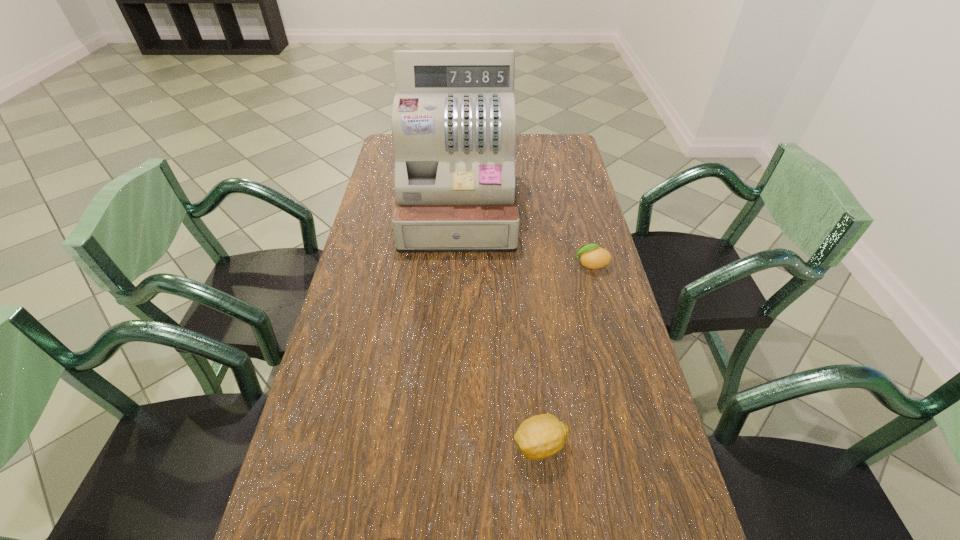
The image size is (960, 540). In order to click on vacant region between the left lemon and the tallest object in this screenshot , I will do `click(499, 327)`.

Locate an element on the screen. Image resolution: width=960 pixels, height=540 pixels. free area in between the rightmost object and the tallest object is located at coordinates (524, 237).

Where is `vacant point located between the farther lemon and the tallest object`? The image size is (960, 540). vacant point located between the farther lemon and the tallest object is located at coordinates (524, 237).

Locate an element on the screen. This screenshot has height=540, width=960. free space between the right lemon and the nearest object is located at coordinates (565, 355).

Locate an element on the screen. Image resolution: width=960 pixels, height=540 pixels. vacant region between the left lemon and the right lemon is located at coordinates point(565,355).

Identify the location of the second closest object to the rightmost object. (541, 436).

The height and width of the screenshot is (540, 960). I want to click on object that is the second closest to the nearer lemon, so click(x=453, y=122).

Select which lemon is the second closest to the tallest object. Please provide its 2D coordinates. Your answer should be formatted as a tuple, i.e. [(x, y)], where the tuple contains the x and y coordinates of a point satisfying the conditions above.

[(541, 436)]